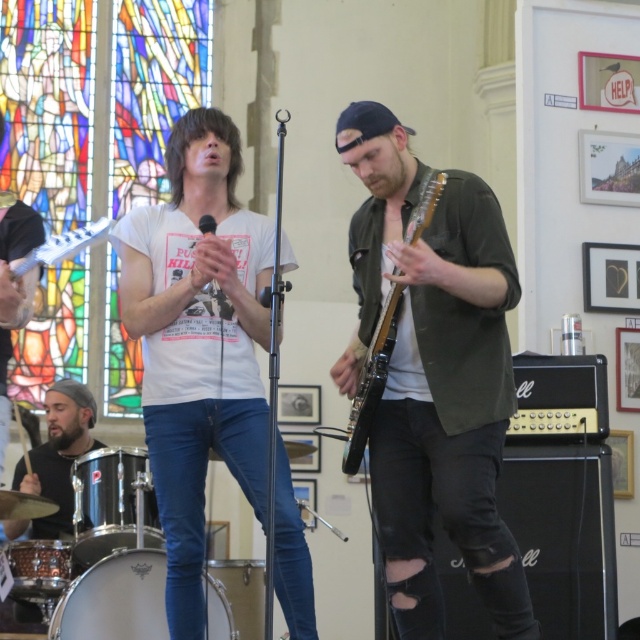
Question: Which point is farther from the camera taking this photo?

Choices:
 (A) (108, 228)
 (B) (112, 564)
 (C) (262, 564)

Answer: (C)

Question: Which object is the closest to the brushed metal drum at lower left?

Choices:
 (A) distressed olive-green shirt at center
 (B) stained glass window at upper left
 (C) silver metallic drum at lower left

Answer: (C)

Question: Does stained glass window at upper left appear on the left side of matte white electric guitar at left?

Choices:
 (A) yes
 (B) no

Answer: (A)

Question: Is brushed metal drum at lower left wider than matte white electric guitar at left?

Choices:
 (A) yes
 (B) no

Answer: (B)

Question: Which of these objects is positioned farthest from the distressed olive-green shirt at center?

Choices:
 (A) brushed metal drum at lower left
 (B) black matte microphone at center
 (C) wooden electric guitar at center
 (D) black drum at lower left

Answer: (A)

Question: Observing the image, what is the correct spatial positioning of silver metallic drum at lower left in reference to brushed metal drum at lower left?

Choices:
 (A) above
 (B) below

Answer: (A)